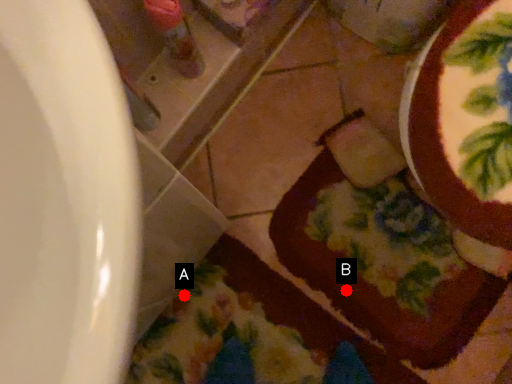
Question: Two points are circled on the image, labeled by A and B beside each circle. Which point appears farthest from the camera in this image?

Choices:
 (A) A is further
 (B) B is further

Answer: (A)